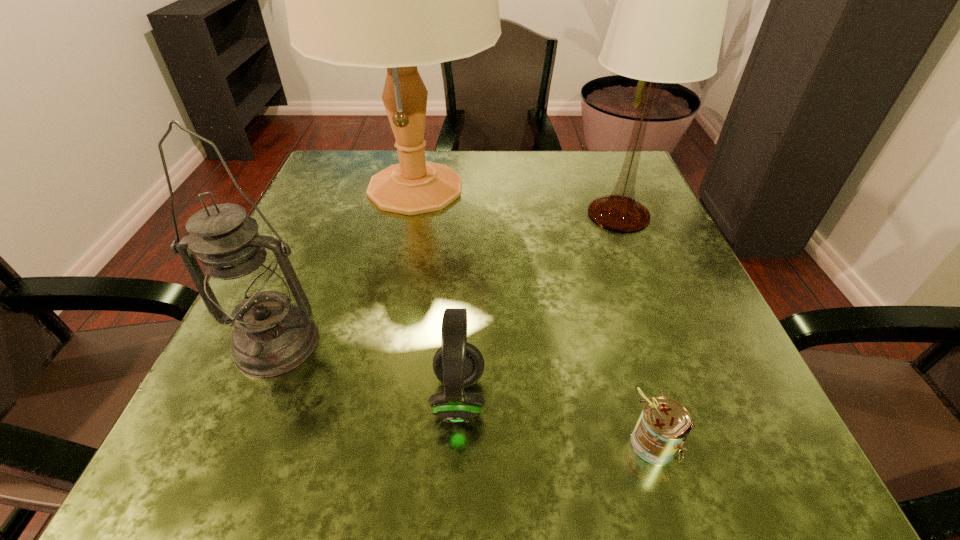
You are a GUI agent. You are given a task and a screenshot of the screen. Output one action in this format:
    pyautogui.click(x=<x>, y=<y>)
    Task: Click on the taller table lamp
    The height and width of the screenshot is (540, 960).
    Given the screenshot: What is the action you would take?
    (397, 0)

Locate an element on the screen. The height and width of the screenshot is (540, 960). the tallest object is located at coordinates (397, 0).

Where is `the right table lamp`? The image size is (960, 540). the right table lamp is located at coordinates (667, 26).

Locate an element on the screen. The height and width of the screenshot is (540, 960). the shorter table lamp is located at coordinates (667, 26).

You are a GUI agent. You are given a task and a screenshot of the screen. Output one action in this format:
    pyautogui.click(x=<x>, y=<y>)
    Task: Click on the third shortest object
    This screenshot has width=960, height=540.
    Given the screenshot: What is the action you would take?
    pyautogui.click(x=245, y=287)

Where is `the second shortest object`? This screenshot has height=540, width=960. the second shortest object is located at coordinates (457, 364).

Locate an element on the screen. This screenshot has width=960, height=540. can is located at coordinates (664, 424).

I want to click on vacant space situated 0.250m on the front of the left table lamp, so click(386, 338).

Where is `vacant space located above the cylindrical shade of the right table lamp`? The image size is (960, 540). vacant space located above the cylindrical shade of the right table lamp is located at coordinates (641, 273).

Where is `vacant space located on the right of the oil lamp`? The height and width of the screenshot is (540, 960). vacant space located on the right of the oil lamp is located at coordinates (493, 343).